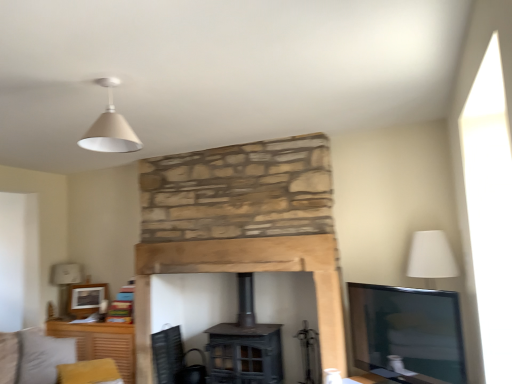
Question: Considering the positions of matte wooden picture frame at upper left and white fabric lampshade at left in the image, is matte wooden picture frame at upper left wider or thinner than white fabric lampshade at left?

Choices:
 (A) wide
 (B) thin

Answer: (B)

Question: Based on their positions, is matte wooden picture frame at upper left located to the left or right of white fabric lampshade at left?

Choices:
 (A) left
 (B) right

Answer: (B)

Question: Estimate the real-world distances between objects in this image. Which object is closer to the rustic wood fireplace at center?

Choices:
 (A) light gray fabric couch at lower left
 (B) matte white cone at upper center
 (C) matte wooden picture frame at upper left
 (D) black mesh swivel chair at lower left
 (E) white fabric lampshade at left

Answer: (D)

Question: Estimate the real-world distances between objects in this image. Which object is closer to the matte white cone at upper center?

Choices:
 (A) matte wooden picture frame at upper left
 (B) black mesh swivel chair at lower left
 (C) light gray fabric couch at lower left
 (D) rustic wood fireplace at center
 (E) white fabric lampshade at left

Answer: (D)